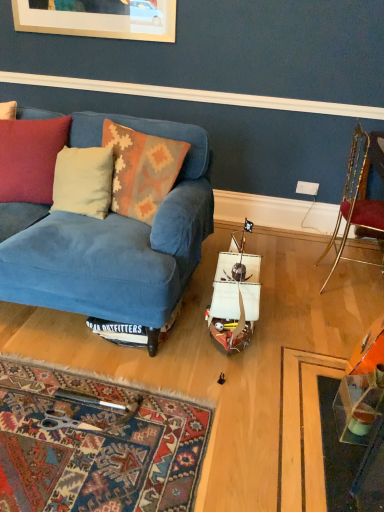
Question: Should I look upward or downward to see white plastic power outlet at center?

Choices:
 (A) down
 (B) up

Answer: (B)

Question: In which direction should I rotate to look at knitted wool pillow at center, acting as the 1th pillow starting from the right?

Choices:
 (A) left
 (B) right

Answer: (A)

Question: Can you confirm if velvet cushion at left is bigger than knitted wool pillow at center, acting as the 1th pillow starting from the right?

Choices:
 (A) yes
 (B) no

Answer: (A)

Question: Can you confirm if velvet cushion at left is thinner than knitted wool pillow at center, which is counted as the 2th pillow, starting from the left?

Choices:
 (A) yes
 (B) no

Answer: (B)

Question: Is velvet cushion at left touching knitted wool pillow at center, which is counted as the 2th pillow, starting from the left?

Choices:
 (A) no
 (B) yes

Answer: (A)

Question: Can you confirm if velvet cushion at left is positioned to the right of knitted wool pillow at center, which is counted as the 2th pillow, starting from the left?

Choices:
 (A) yes
 (B) no

Answer: (B)

Question: Considering the relative sizes of velvet cushion at left and knitted wool pillow at center, which is counted as the 2th pillow, starting from the left, in the image provided, is velvet cushion at left taller than knitted wool pillow at center, which is counted as the 2th pillow, starting from the left,?

Choices:
 (A) no
 (B) yes

Answer: (A)

Question: Can we say velvet cushion at left lies outside knitted wool pillow at center, which is counted as the 2th pillow, starting from the left?

Choices:
 (A) no
 (B) yes

Answer: (B)

Question: Considering the relative sizes of blue velvet couch at center and gold metallic chair at right in the image provided, is blue velvet couch at center shorter than gold metallic chair at right?

Choices:
 (A) yes
 (B) no

Answer: (A)

Question: From a real-world perspective, is blue velvet couch at center physically below gold metallic chair at right?

Choices:
 (A) no
 (B) yes

Answer: (B)

Question: From a real-world perspective, does blue velvet couch at center stand above gold metallic chair at right?

Choices:
 (A) no
 (B) yes

Answer: (A)

Question: Is gold metallic chair at right at the back of blue velvet couch at center?

Choices:
 (A) yes
 (B) no

Answer: (B)

Question: Is blue velvet couch at center further to the viewer compared to gold metallic chair at right?

Choices:
 (A) no
 (B) yes

Answer: (A)

Question: From the image's perspective, is blue velvet couch at center on gold metallic chair at right?

Choices:
 (A) yes
 (B) no

Answer: (B)

Question: Is gold metallic chair at right positioned beyond the bounds of transparent plastic table at lower right?

Choices:
 (A) yes
 (B) no

Answer: (A)